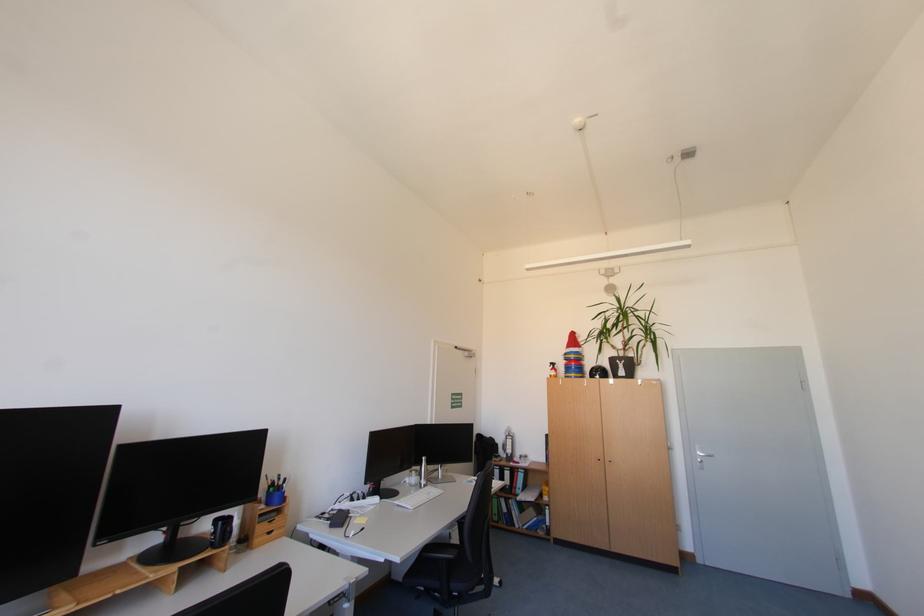
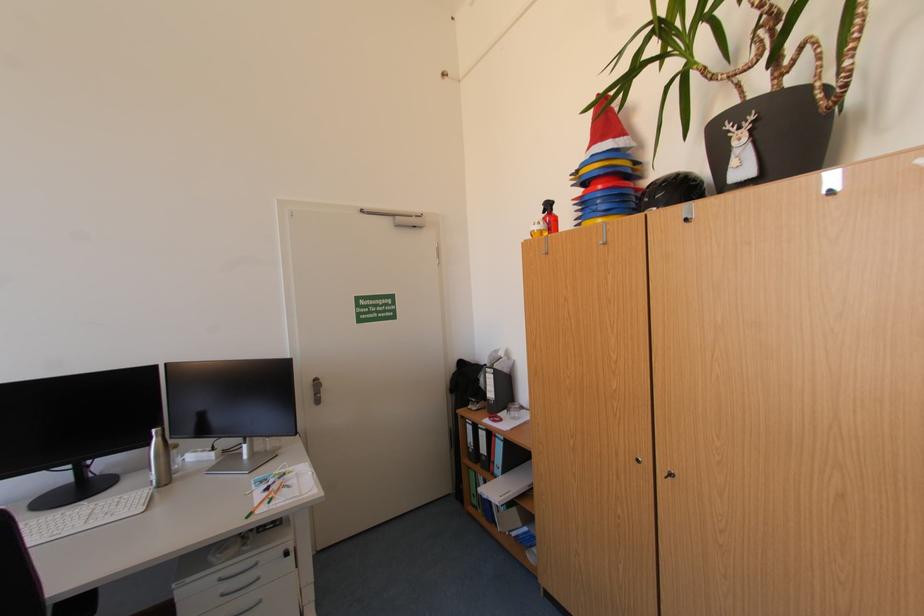
Find the pixel in the second image that matches the point at 581,369 in the first image.

(606, 203)